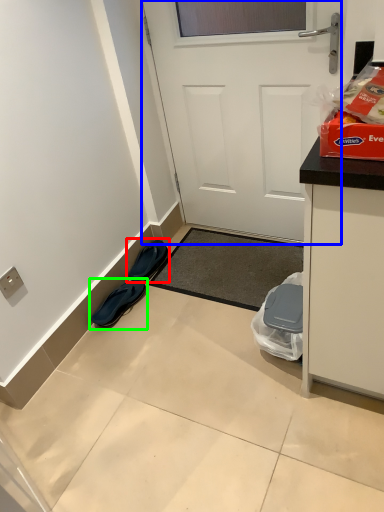
Question: Which object is positioned closest to footwear (highlighted by a red box)? Select from door (highlighted by a blue box) and footwear (highlighted by a green box).

Choices:
 (A) door
 (B) footwear

Answer: (B)